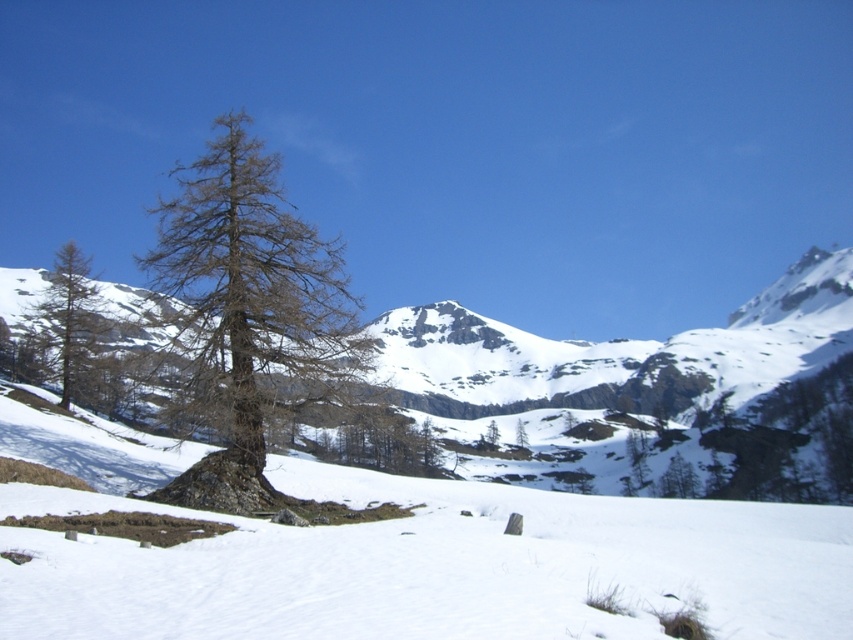
Question: Can you confirm if brown/driedtree at left is positioned to the left of brown matte tree at left?

Choices:
 (A) no
 (B) yes

Answer: (A)

Question: Does brown/driedtree at left appear over brown matte tree at left?

Choices:
 (A) yes
 (B) no

Answer: (A)

Question: Among these objects, which one is nearest to the camera?

Choices:
 (A) brown matte tree at left
 (B) brown/driedtree at left

Answer: (B)

Question: Among these objects, which one is nearest to the camera?

Choices:
 (A) brown matte tree at left
 (B) brown/driedtree at left

Answer: (B)

Question: Is brown/driedtree at left above brown matte tree at left?

Choices:
 (A) yes
 (B) no

Answer: (A)